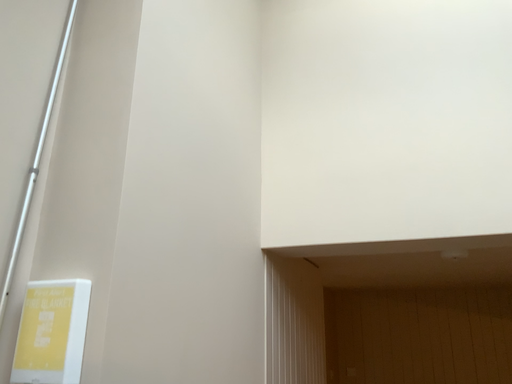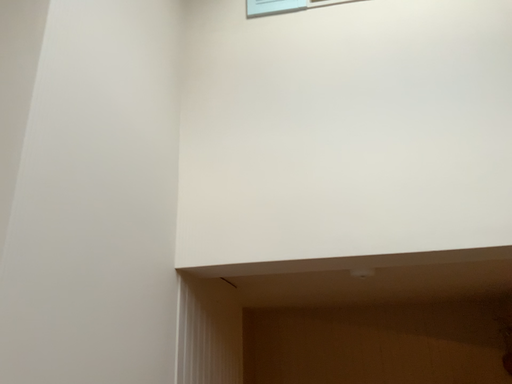
Question: How did the camera likely rotate when shooting the video?

Choices:
 (A) rotated left
 (B) rotated right

Answer: (B)